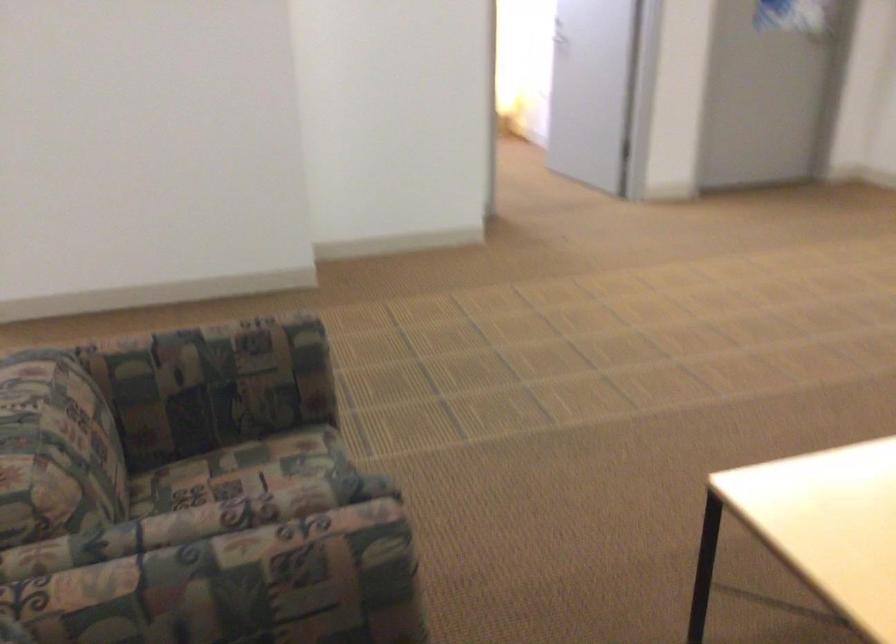
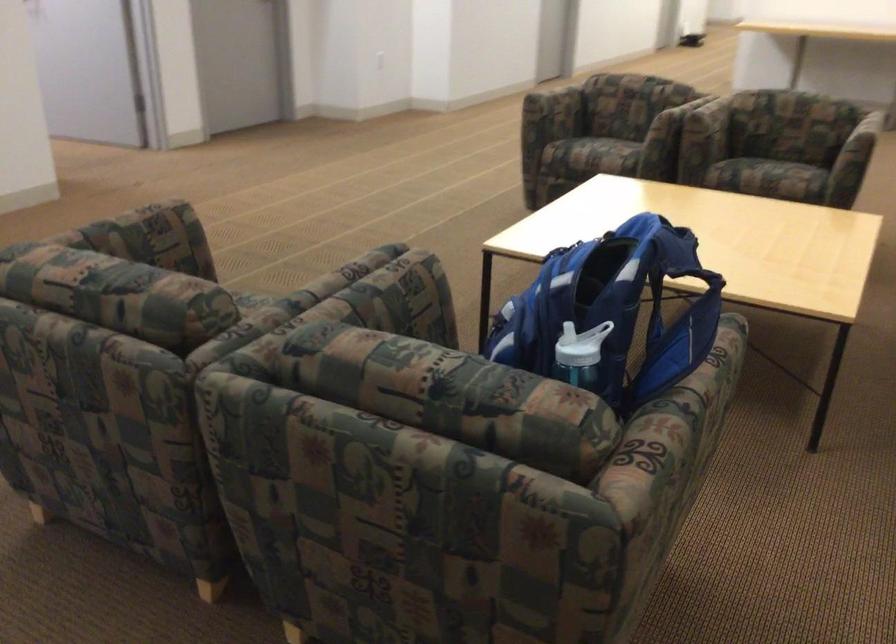
Find the pixel in the second image that matches [218,351] in the first image.

(141, 232)